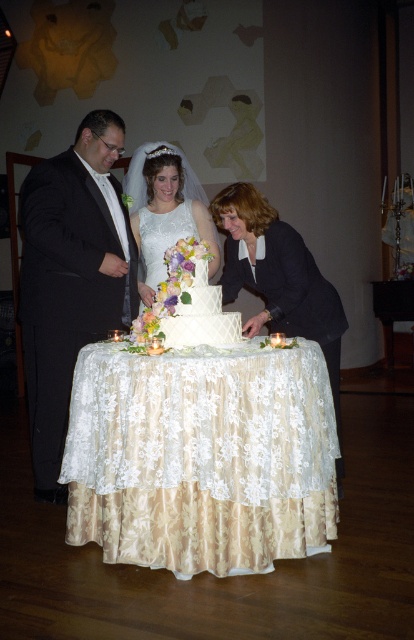
Who is more distant from viewer, (70, 472) or (146, 224)?

Point (146, 224)

Is the position of lace fabric tablecloth at center more distant than that of white lace dress at center?

No, it is in front of white lace dress at center.

Locate an element on the screen. lace fabric tablecloth at center is located at coordinates (202, 456).

Identify the location of lace fabric tablecloth at center. The image size is (414, 640). (202, 456).

Which is more to the right, lace fabric tablecloth at center or black satin suit at left?

lace fabric tablecloth at center is more to the right.

Where is `lace fabric tablecloth at center`? The image size is (414, 640). lace fabric tablecloth at center is located at coordinates (202, 456).

In the scene shown: Which is more to the right, white lace dress at center or white lace cocktail dress at center?

white lace dress at center

Does white lace dress at center have a larger size compared to white lace cocktail dress at center?

Yes, white lace dress at center is bigger than white lace cocktail dress at center.

Is point (187, 177) more distant than point (158, 216)?

Yes, point (187, 177) is behind point (158, 216).

In order to click on white lace dress at center in this screenshot , I will do `click(166, 208)`.